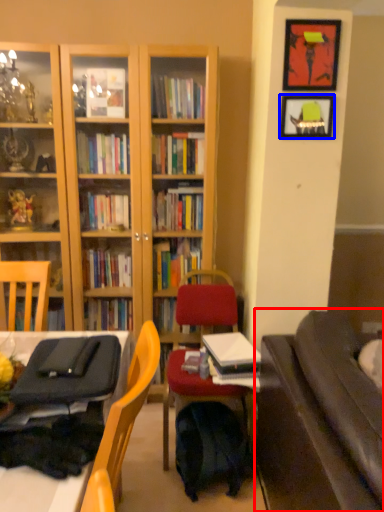
Question: Which object appears farthest to the camera in this image, studio couch (highlighted by a red box) or picture frame (highlighted by a blue box)?

Choices:
 (A) studio couch
 (B) picture frame

Answer: (B)